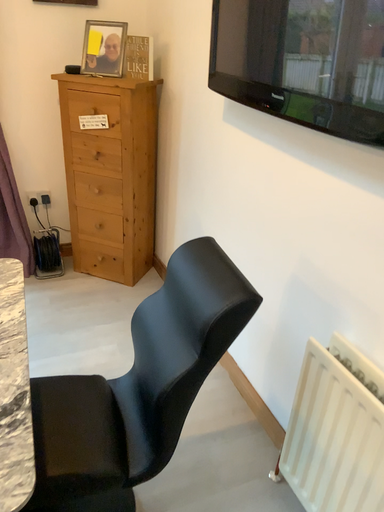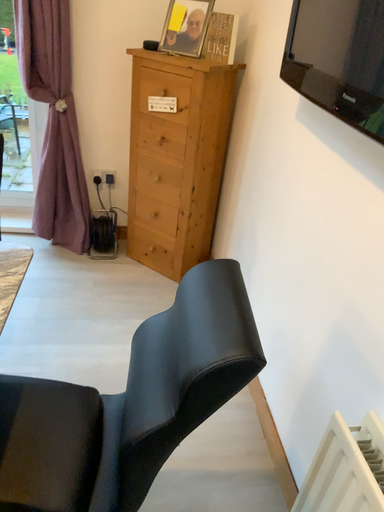
Question: How did the camera likely rotate when shooting the video?

Choices:
 (A) rotated right
 (B) rotated left

Answer: (B)